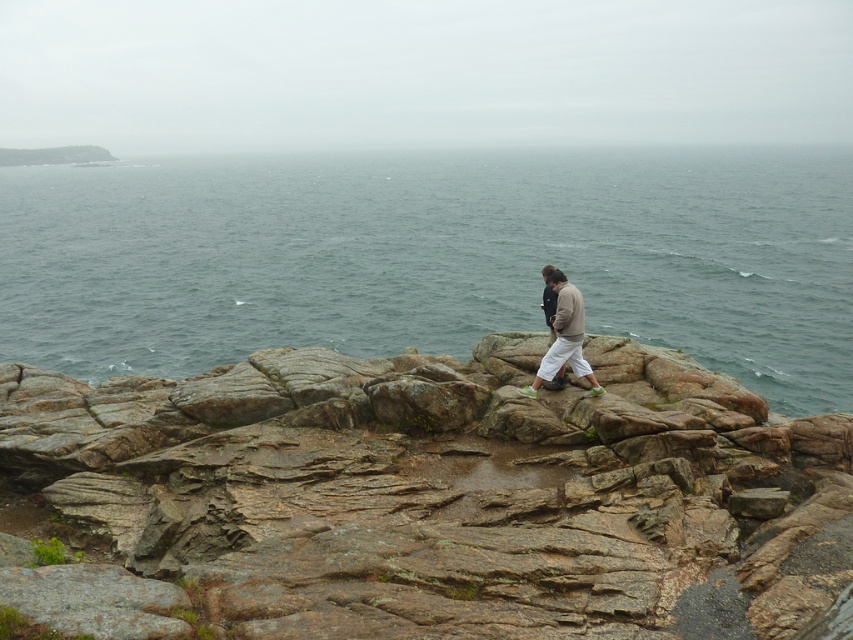
Question: Which point is closer to the camera taking this photo?

Choices:
 (A) (577, 332)
 (B) (248, 572)
 (C) (53, 348)

Answer: (B)

Question: Based on their relative distances, which object is nearer to the greenish-blue water at upper center?

Choices:
 (A) rusty rock at center
 (B) light brown cotton pants at center

Answer: (A)

Question: Is rusty rock at center smaller than greenish-blue water at upper center?

Choices:
 (A) no
 (B) yes

Answer: (B)

Question: Can you confirm if greenish-blue water at upper center is bigger than light brown cotton pants at center?

Choices:
 (A) yes
 (B) no

Answer: (A)

Question: Can you confirm if greenish-blue water at upper center is thinner than light brown cotton pants at center?

Choices:
 (A) yes
 (B) no

Answer: (B)

Question: Which is farther from the rusty rock at center?

Choices:
 (A) greenish-blue water at upper center
 (B) light brown cotton pants at center

Answer: (A)